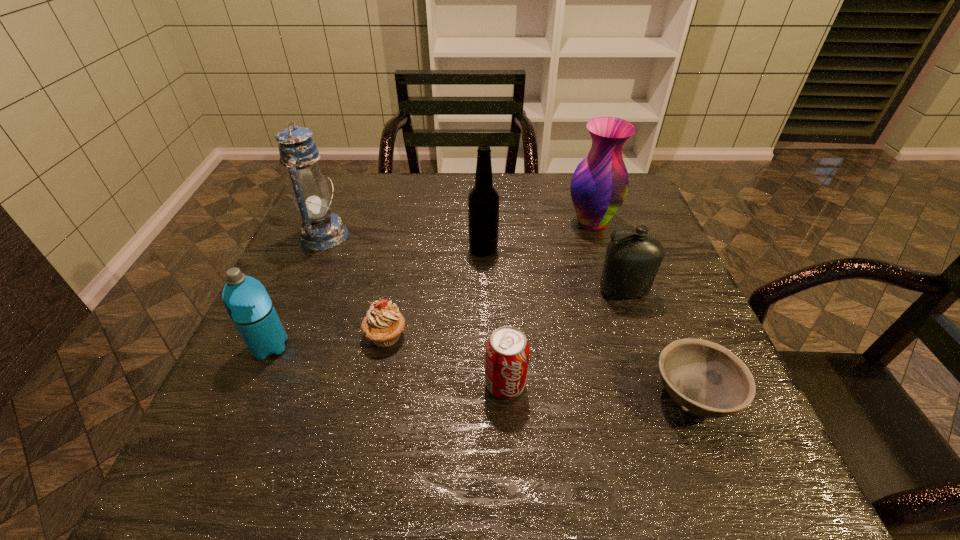
Find the location of a particular element. The width and height of the screenshot is (960, 540). lantern is located at coordinates (320, 230).

Image resolution: width=960 pixels, height=540 pixels. Identify the location of beer bottle. [483, 200].

The image size is (960, 540). What are the coordinates of `vase` in the screenshot? It's located at (599, 185).

Locate an element on the screen. thermos bottle is located at coordinates pyautogui.click(x=246, y=300).

Find the location of a particular element. This screenshot has height=540, width=960. the fifth nearest object is located at coordinates (632, 261).

Find the location of a particular element. The height and width of the screenshot is (540, 960). the sixth tallest object is located at coordinates (507, 353).

This screenshot has width=960, height=540. Find the location of `cupcake`. cupcake is located at coordinates (383, 324).

Where is `the third object from left to right`? This screenshot has height=540, width=960. the third object from left to right is located at coordinates (383, 324).

Find the location of a particular element. bowl is located at coordinates coord(704,378).

This screenshot has height=540, width=960. What are the coordinates of `vacant position located 0.080m on the front-facing side of the lantern` in the screenshot? It's located at (378, 236).